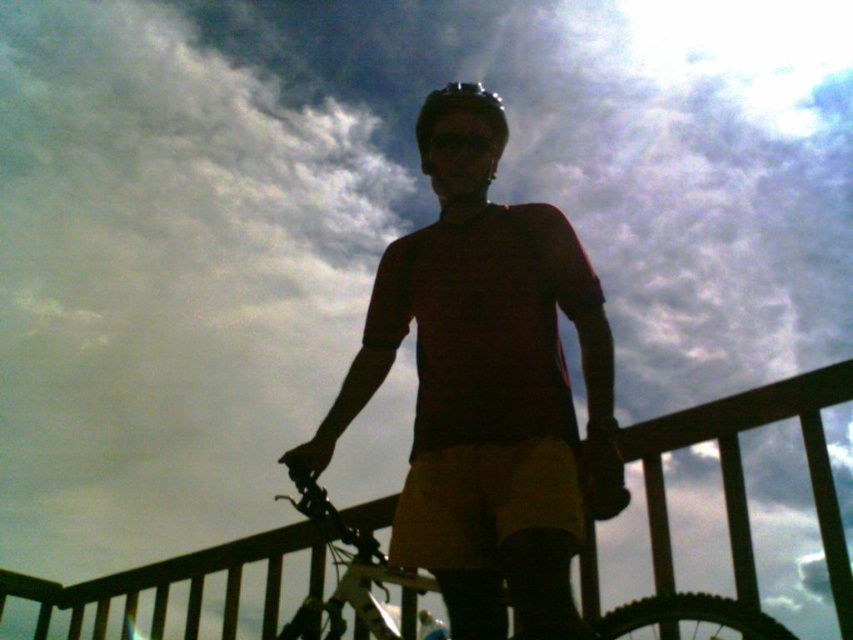
Consider the image. You are planning to take a photo of the metallic silver bicycle at center and the matte black helmet at center. Based on their sizes in the image, which object would appear wider in the photo?

The metallic silver bicycle at center appears wider than the matte black helmet at center in the photo because its width is larger than that of the matte black helmet at center.

You are a photographer trying to capture the scene from the same angle. You notice the black wood rail at center and the matte black helmet at center. Which object should you focus on first if you want to ensure both are in sharp focus?

The black wood rail at center is below matte black helmet at center, so you should focus on the matte black helmet at center first since it is closer to the camera.

You are standing at the point marked by the coordinates point (743,477) in the image. Looking around, you see a black wood rail at center. What object is directly in front of you?

The point (743,477) indicates the location of the black wood rail at center, so the object directly in front of you is the black wood rail at center.